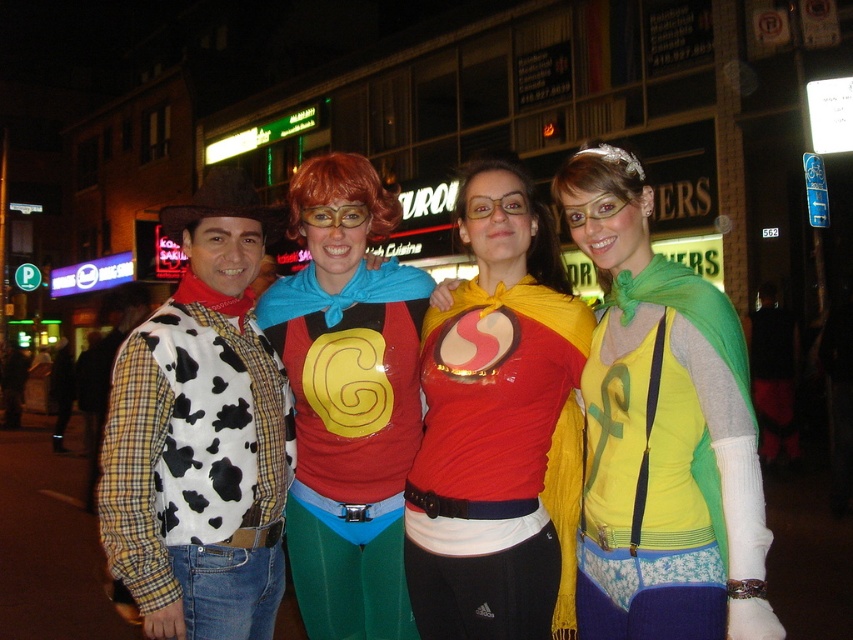
You are a photographer trying to capture a photo of the two central figures in the group. The shiny red cape at center and the cow print vest at center are both important. Which one should you focus on first if you want to capture them from left to right order?

The cow print vest at center should be focused on first since it is positioned to the left of the shiny red cape at center in the image.

You are a photographer trying to capture a clear photo of the shiny red cape at center and the cow print vest at center. Which object should you focus on first if you want to ensure both are in focus, considering their heights?

The shiny red cape at center is taller than the cow print vest at center. To ensure both are in focus, you should focus on the shiny red cape at center first since it is taller and likely further away from the camera.

You are standing in front of the group of four individuals in the image. There are two points marked on the image at coordinates point (592,372) and point (389,365). Which of these two points is closer to you?

Point (592,372) is closer to the viewer than point (389,365).